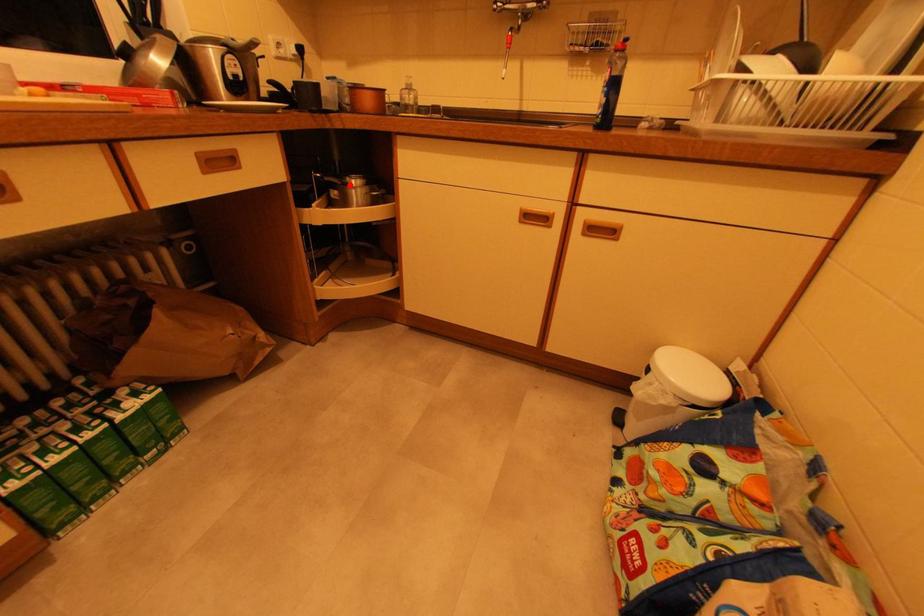
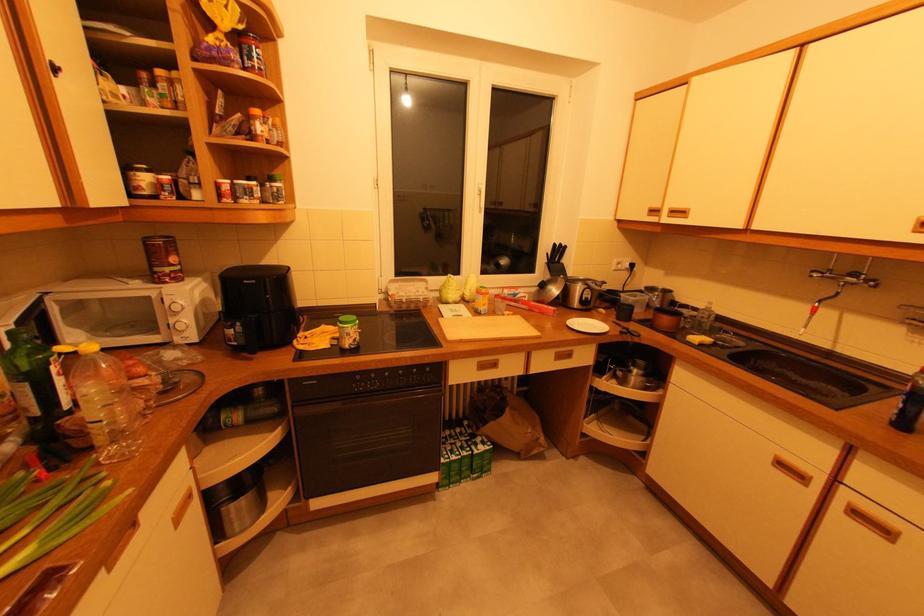
Question: I am providing you with two images of the same scene from different viewpoints. A red point is shown in image1. For the corresponding object point in image2, is it positioned nearer or farther from the camera?

Choices:
 (A) Nearer
 (B) Farther

Answer: (A)